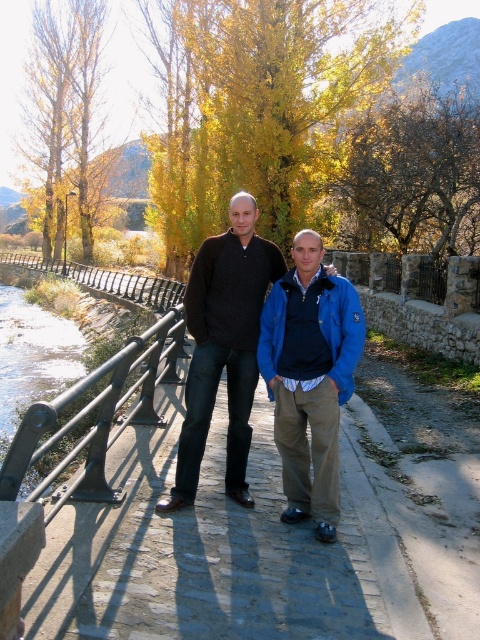
Does matte black sweater at center have a smaller size compared to black metal railing at left?

No.

Is matte black sweater at center bigger than black metal railing at left?

Indeed, matte black sweater at center has a larger size compared to black metal railing at left.

Between point (193, 292) and point (39, 456), which one is positioned in front?

Point (39, 456) is in front.

I want to click on matte black sweater at center, so click(x=224, y=346).

Is blue fabric jacket at center to the right of matte black sweater at center from the viewer's perspective?

Yes, blue fabric jacket at center is to the right of matte black sweater at center.

Can you confirm if blue fabric jacket at center is bigger than matte black sweater at center?

No.

Does point (288, 467) come in front of point (190, 369)?

Yes, point (288, 467) is closer to viewer.

Identify the location of blue fabric jacket at center. This screenshot has width=480, height=640. (310, 378).

Who is more forward, (335, 522) or (168, 376)?

Point (335, 522)

Does blue fabric jacket at center have a greater height compared to black metal railing at left?

Yes.

Which is in front, point (300, 355) or point (152, 397)?

Point (300, 355) is in front.

Image resolution: width=480 pixels, height=640 pixels. Identify the location of blue fabric jacket at center. (310, 378).